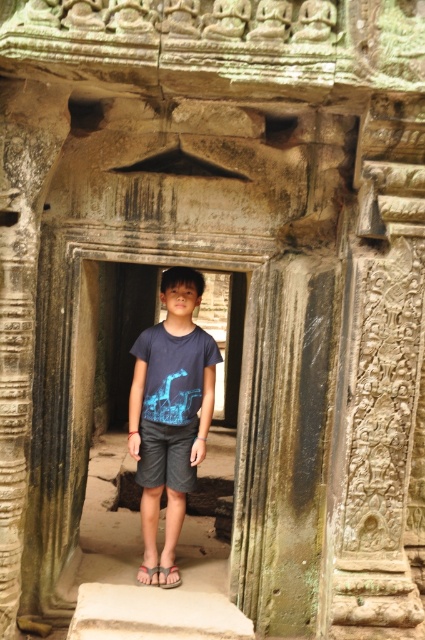
Question: Can you confirm if matte blue t-shirt at center is bigger than brown fabric sandal at center?

Choices:
 (A) no
 (B) yes

Answer: (B)

Question: Can you confirm if matte blue t-shirt at center is thinner than smooth stone doorway at center?

Choices:
 (A) no
 (B) yes

Answer: (B)

Question: Estimate the real-world distances between objects in this image. Which object is farther from the brown fabric sandal at center?

Choices:
 (A) matte blue t-shirt at center
 (B) dark gray cotton shorts at center

Answer: (A)

Question: Considering the real-world distances, which object is closest to the dark gray cotton shorts at center?

Choices:
 (A) brown fabric sandal at center
 (B) matte blue t-shirt at center

Answer: (B)

Question: From the image, what is the correct spatial relationship of smooth stone doorway at center in relation to gray fabric sandal at center?

Choices:
 (A) above
 (B) below

Answer: (A)

Question: Which point appears closest to the camera in this image?

Choices:
 (A) (146, 461)
 (B) (130, 406)

Answer: (A)